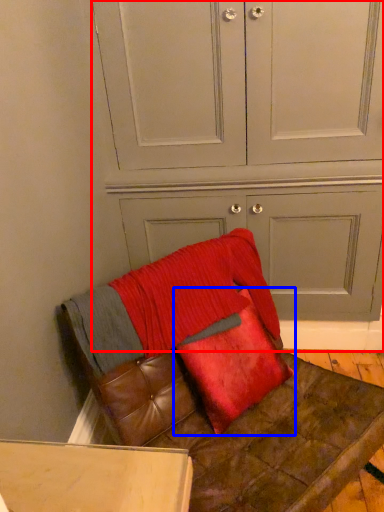
Question: Which of the following is the closest to the observer, dresser (highlighted by a red box) or pillow (highlighted by a blue box)?

Choices:
 (A) dresser
 (B) pillow

Answer: (B)